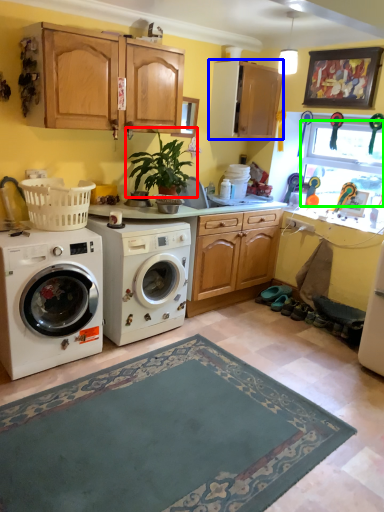
Question: Which is nearer to the plant (highlighted by a red box)? cabinetry (highlighted by a blue box) or window screen (highlighted by a green box).

Choices:
 (A) cabinetry
 (B) window screen

Answer: (A)